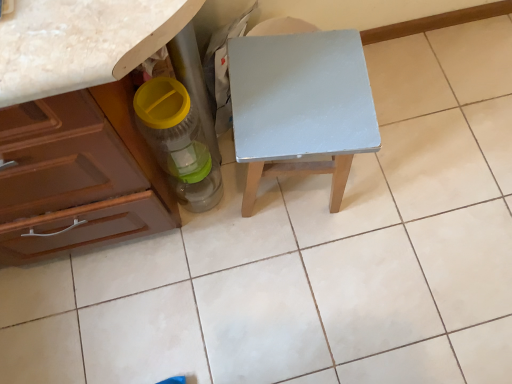
Find the location of a particular element. The height and width of the screenshot is (384, 512). unoccupied area in front of light gray wood table at center is located at coordinates (295, 264).